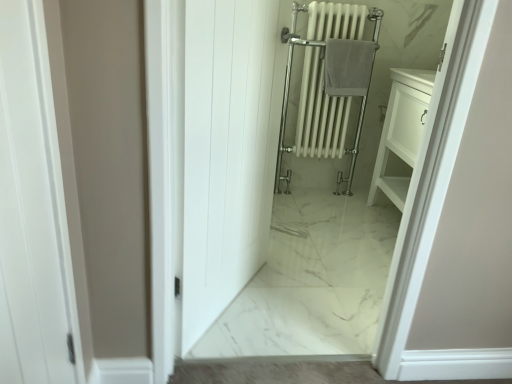
Question: Is point (241, 153) positioned closer to the camera than point (373, 44)?

Choices:
 (A) closer
 (B) farther

Answer: (A)

Question: Is white wood door at center inside the boundaries of gray cotton towel at center, or outside?

Choices:
 (A) outside
 (B) inside

Answer: (A)

Question: Estimate the real-world distances between objects in this image. Which object is farther from the white wood door at center?

Choices:
 (A) gray cotton towel at center
 (B) white glossy radiator at center

Answer: (B)

Question: Which object is the closest to the white wood door at center?

Choices:
 (A) white glossy radiator at center
 (B) gray cotton towel at center

Answer: (B)